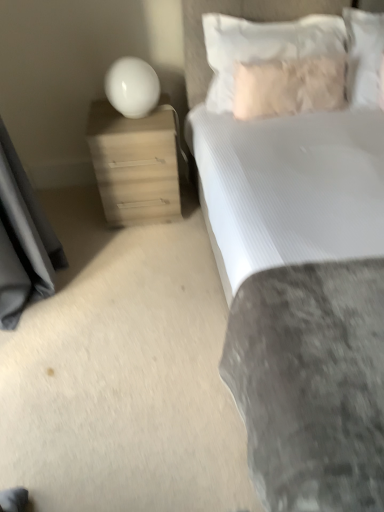
At what (x,y) coordinates should I click in order to perform the action: click on vacant area that is in front of white glossy sphere at upper left. Please return your answer as a coordinate pair (x, y). Looking at the image, I should click on (131, 130).